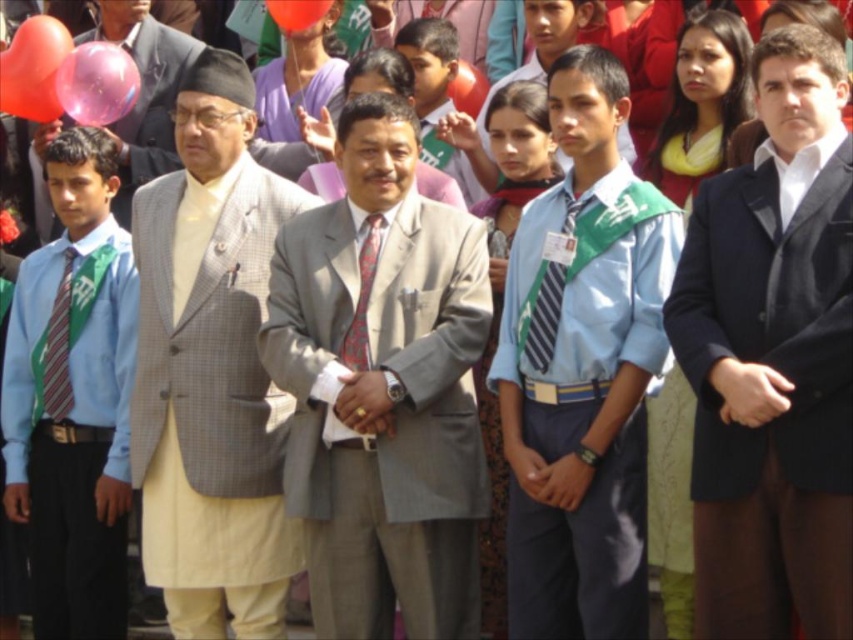
You are organizing a photo shoot and need to arrange two props in a specific way. You have a rubber heart at upper left and a striped fabric tie at center. According to the scene, which prop is located to the left of the other?

The rubber heart at upper left is positioned on the left side of striped fabric tie at center.

You are a photographer at this event and want to capture both the dark blue suit at center and the rubber heart at upper left in a single photo. Since the camera can only focus on objects at the same distance, which object should you move closer to ensure both are in focus?

You should move closer to the dark blue suit at center because it is closer to the viewer than the rubber heart at upper left. By moving closer to it, you can adjust the focus so both objects are at the same distance from the camera.

You are at an outdoor event and see a rubber heart at upper left and a rubber balloon at upper center. Which object is taller?

The rubber heart at upper left is taller than the rubber balloon at upper center.